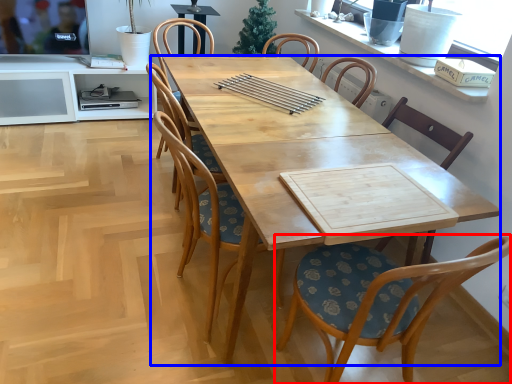
Question: Among these objects, which one is nearest to the camera, chair (highlighted by a red box) or desk (highlighted by a blue box)?

Choices:
 (A) chair
 (B) desk

Answer: (A)